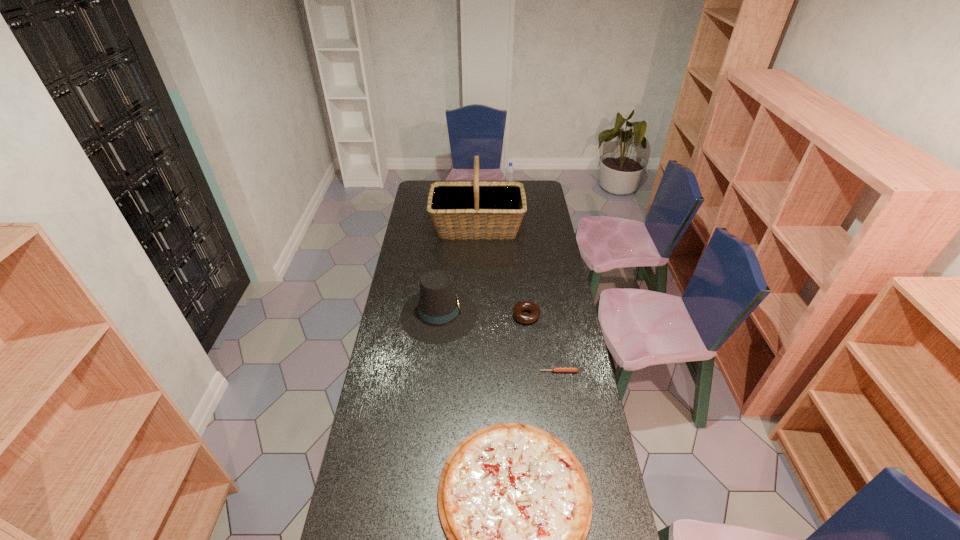
The height and width of the screenshot is (540, 960). Identify the location of the second farthest object. (476, 209).

Locate an element on the screen. The height and width of the screenshot is (540, 960). basket is located at coordinates (476, 209).

In order to click on water bottle in this screenshot , I will do `click(510, 171)`.

Locate an element on the screen. hat is located at coordinates (438, 314).

Locate an element on the screen. the third shortest object is located at coordinates (534, 310).

This screenshot has height=540, width=960. What are the coordinates of `the fifth farthest object` in the screenshot? It's located at (554, 369).

Where is `sausage`? This screenshot has width=960, height=540. sausage is located at coordinates (554, 369).

At what (x,y) coordinates should I click in order to perform the action: click on free spot located by the handle of the fifth nearest object. Please return your answer as a coordinate pair (x, y). This screenshot has height=540, width=960. Looking at the image, I should click on (538, 227).

You are a GUI agent. You are given a task and a screenshot of the screen. Output one action in this format:
    pyautogui.click(x=<x>, y=<y>)
    Task: Click on the free space located 0.070m on the back of the water bottle
    This screenshot has height=540, width=960.
    Given the screenshot: What is the action you would take?
    pyautogui.click(x=509, y=187)

Where is `vacant space located on the front-facing side of the hat`? vacant space located on the front-facing side of the hat is located at coordinates (558, 314).